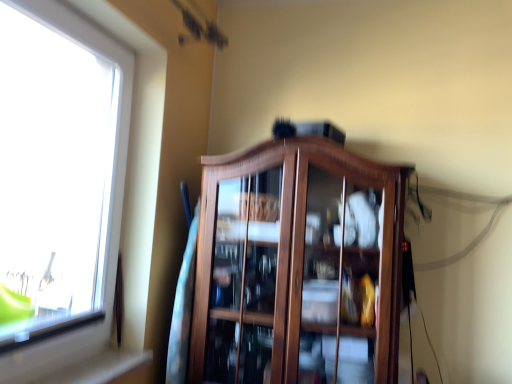
In the scene shown: What is the approximate width of transparent glass window at left?

3.96 inches.

Image resolution: width=512 pixels, height=384 pixels. In order to click on transparent glass window at left in this screenshot , I will do `click(54, 173)`.

The height and width of the screenshot is (384, 512). What do you see at coordinates (54, 173) in the screenshot?
I see `transparent glass window at left` at bounding box center [54, 173].

Identify the location of wooden cabinet at center. This screenshot has width=512, height=384. click(x=298, y=266).

What is the approximate width of wooden cabinet at center?

47.44 centimeters.

Describe the element at coordinates (298, 266) in the screenshot. The height and width of the screenshot is (384, 512). I see `wooden cabinet at center` at that location.

At what (x,y) coordinates should I click in order to perform the action: click on transparent glass window at left. Please return your answer as a coordinate pair (x, y). The image size is (512, 384). Looking at the image, I should click on (54, 173).

Can you confirm if transparent glass window at left is positioned to the left of wooden cabinet at center?

Yes.

In the image, is transparent glass window at left positioned in front of or behind wooden cabinet at center?

transparent glass window at left is in front of wooden cabinet at center.

Which is in front, point (28, 158) or point (377, 360)?

The point (377, 360) is in front.

From the picture: From the image's perspective, between transparent glass window at left and wooden cabinet at center, who is located below?

wooden cabinet at center appears lower in the image.

From a real-world perspective, does transparent glass window at left sit lower than wooden cabinet at center?

Actually, transparent glass window at left is physically above wooden cabinet at center in the real world.

Considering the relative sizes of transparent glass window at left and wooden cabinet at center in the image provided, is transparent glass window at left thinner than wooden cabinet at center?

Indeed, transparent glass window at left has a lesser width compared to wooden cabinet at center.

Does transparent glass window at left have a greater height compared to wooden cabinet at center?

Indeed, transparent glass window at left has a greater height compared to wooden cabinet at center.

In terms of size, does transparent glass window at left appear bigger or smaller than wooden cabinet at center?

In the image, transparent glass window at left appears to be smaller than wooden cabinet at center.

Can we say transparent glass window at left lies outside wooden cabinet at center?

Yes, transparent glass window at left is outside of wooden cabinet at center.

Are transparent glass window at left and wooden cabinet at center far apart?

transparent glass window at left is actually quite close to wooden cabinet at center.

Does transparent glass window at left turn towards wooden cabinet at center?

No, transparent glass window at left is not turned towards wooden cabinet at center.

How much distance is there between transparent glass window at left and wooden cabinet at center?

32.31 inches.

The image size is (512, 384). What are the coordinates of `dresser below the transparent glass window at left (from the image's perspective)` in the screenshot? It's located at (298, 266).

In the image, is wooden cabinet at center on the left side or the right side of transparent glass window at left?

Clearly, wooden cabinet at center is on the right of transparent glass window at left in the image.

Does wooden cabinet at center lie behind transparent glass window at left?

Yes, the depth of wooden cabinet at center is greater than that of transparent glass window at left.

Is point (286, 263) more distant than point (28, 283)?

No, it is in front of (28, 283).

From the image's perspective, between wooden cabinet at center and transparent glass window at left, which one is located above?

transparent glass window at left, from the image's perspective.

From a real-world perspective, is wooden cabinet at center physically below transparent glass window at left?

Yes.

Does wooden cabinet at center have a lesser width compared to transparent glass window at left?

No, wooden cabinet at center is not thinner than transparent glass window at left.

Considering the sizes of wooden cabinet at center and transparent glass window at left in the image, is wooden cabinet at center taller or shorter than transparent glass window at left?

Considering their sizes, wooden cabinet at center has less height than transparent glass window at left.

Considering the relative sizes of wooden cabinet at center and transparent glass window at left in the image provided, is wooden cabinet at center smaller than transparent glass window at left?

No.

Which is correct: wooden cabinet at center is inside transparent glass window at left, or outside of it?

wooden cabinet at center cannot be found inside transparent glass window at left.

Is wooden cabinet at center directly adjacent to transparent glass window at left?

No, wooden cabinet at center is not with transparent glass window at left.

Is wooden cabinet at center looking in the opposite direction of transparent glass window at left?

No, wooden cabinet at center's orientation is not away from transparent glass window at left.

Can you tell me how much wooden cabinet at center and transparent glass window at left differ in facing direction?

There is a 91.7-degree angle between the facing directions of wooden cabinet at center and transparent glass window at left.

Where is `window above the wooden cabinet at center (from a real-world perspective)`? window above the wooden cabinet at center (from a real-world perspective) is located at coordinates (54, 173).

Locate an element on the screen. dresser below the transparent glass window at left (from the image's perspective) is located at coordinates (298, 266).

I want to click on window that appears in front of the wooden cabinet at center, so click(54, 173).